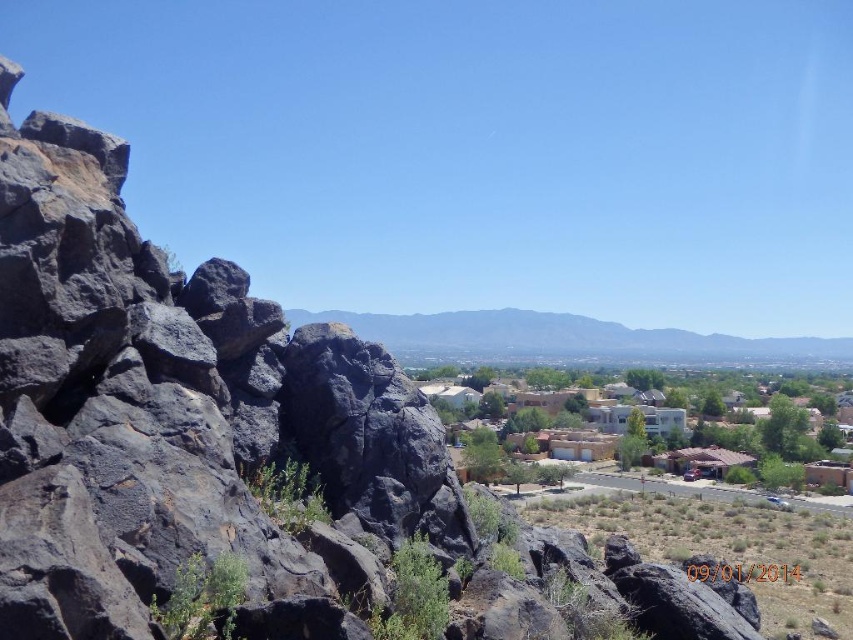
Can you confirm if adobe houses at center is taller than gray rock formation at center?

In fact, adobe houses at center may be shorter than gray rock formation at center.

Does point (676, 412) come farther from viewer compared to point (602, 326)?

That is False.

Find the location of `adobe houses at center`. adobe houses at center is located at coordinates pyautogui.click(x=683, y=440).